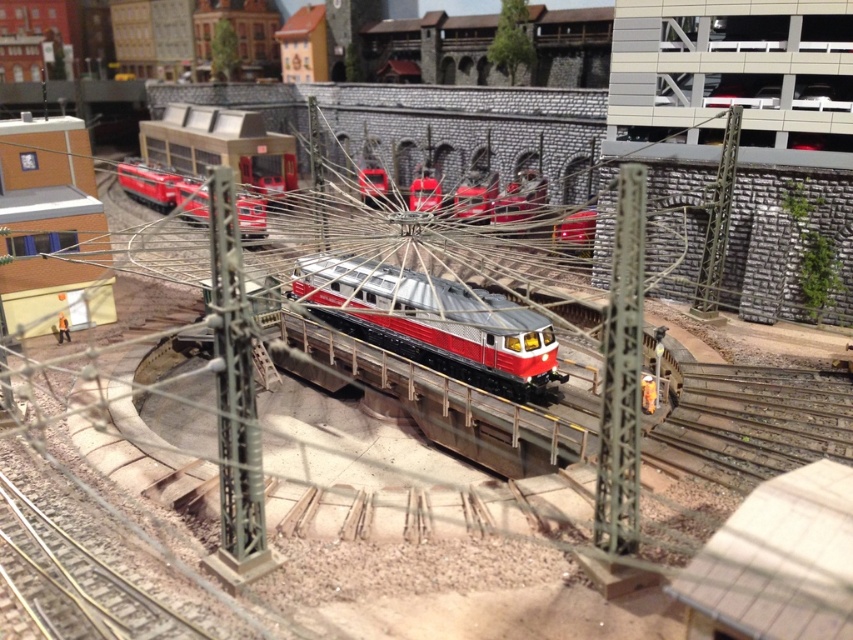
Question: Is metallic silver train at center below matte red train at upper left?

Choices:
 (A) yes
 (B) no

Answer: (A)

Question: Can you confirm if red matte train at center is bigger than red glossy train at center?

Choices:
 (A) yes
 (B) no

Answer: (A)

Question: Is red matte train at center thinner than matte red train at upper left?

Choices:
 (A) yes
 (B) no

Answer: (B)

Question: Based on their relative distances, which object is nearer to the red matte train at center?

Choices:
 (A) matte red train at upper left
 (B) metallic silver train at center

Answer: (A)

Question: Which point is closer to the camera?

Choices:
 (A) (376, 202)
 (B) (187, 156)
 (C) (451, 376)

Answer: (C)

Question: Considering the real-world distances, which object is closest to the red matte train at center?

Choices:
 (A) red glossy train at center
 (B) matte red train at upper left

Answer: (B)